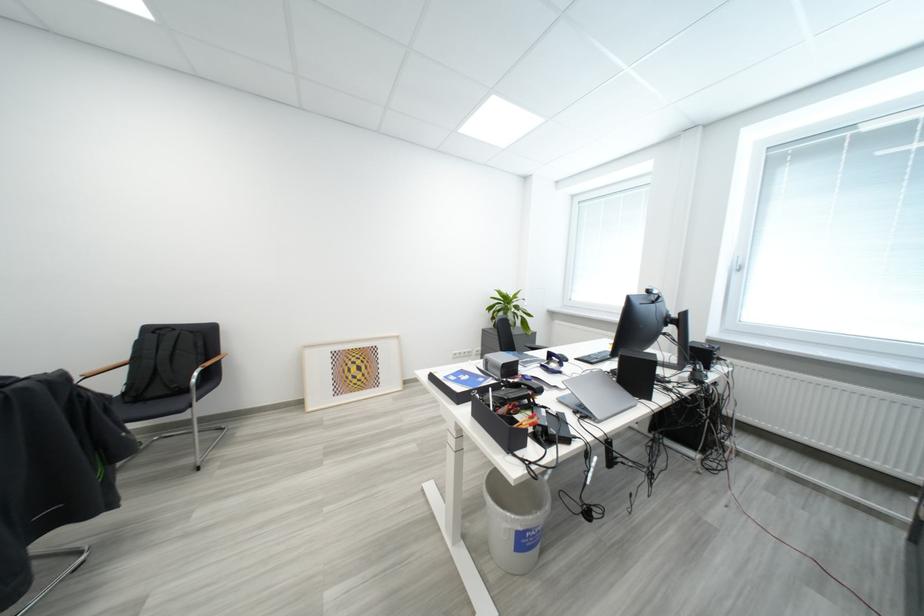
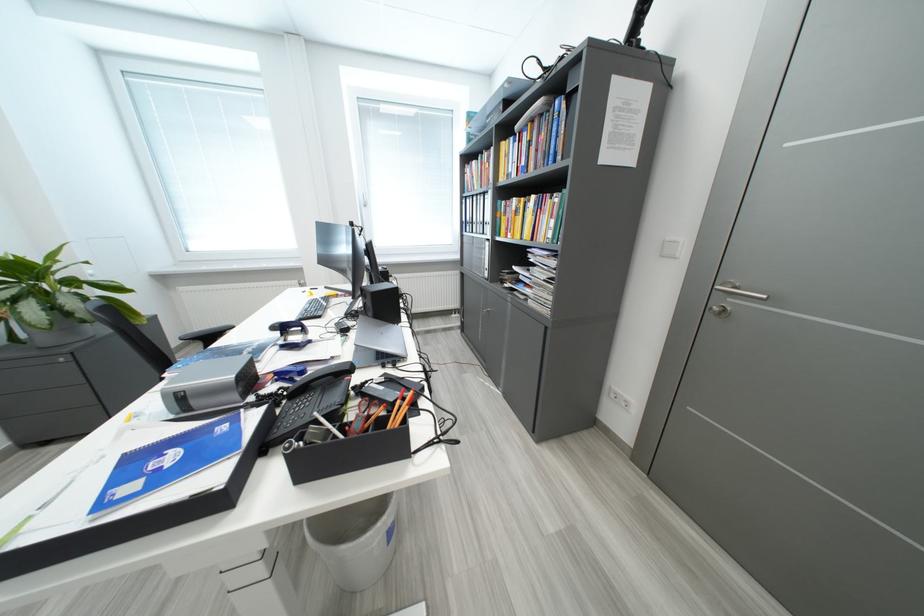
How did the camera likely rotate?

The camera rotated toward right-down.